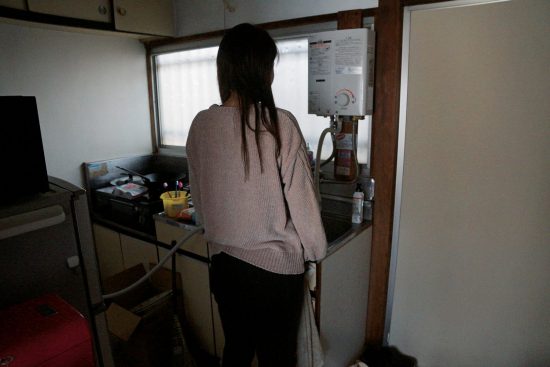
I want to click on table holding black appliance, so click(x=76, y=210).